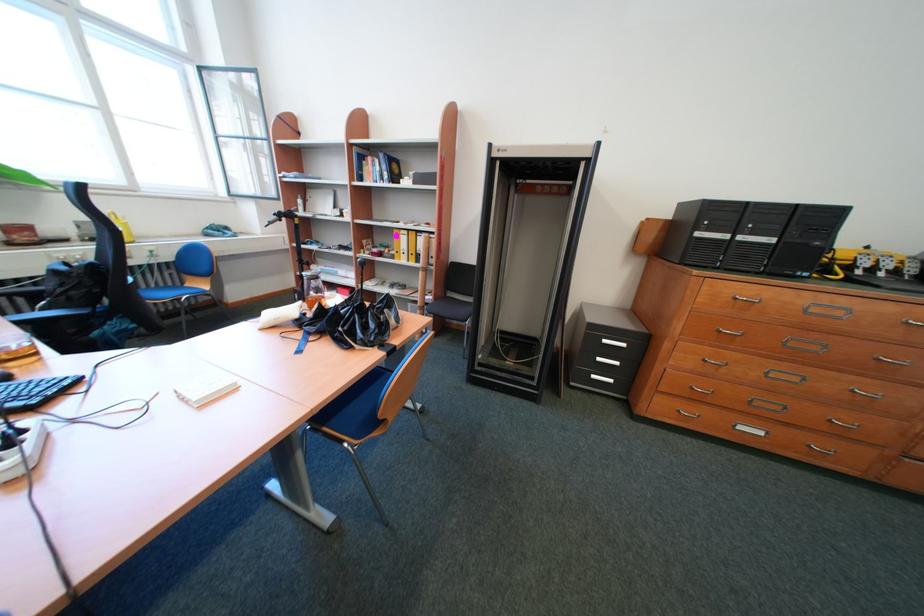
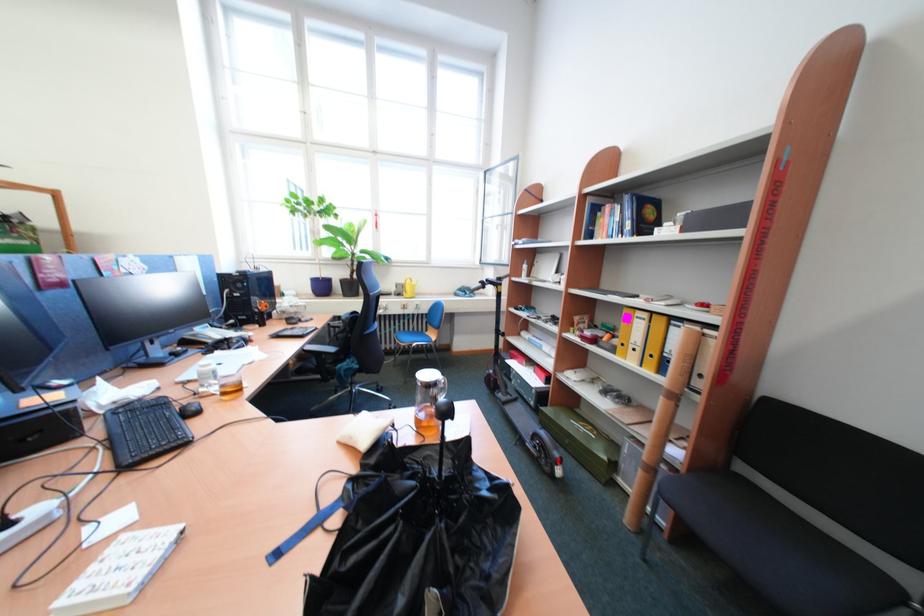
Find the pixel in the second image that matches pixel 79 243 in the first image.

(403, 296)